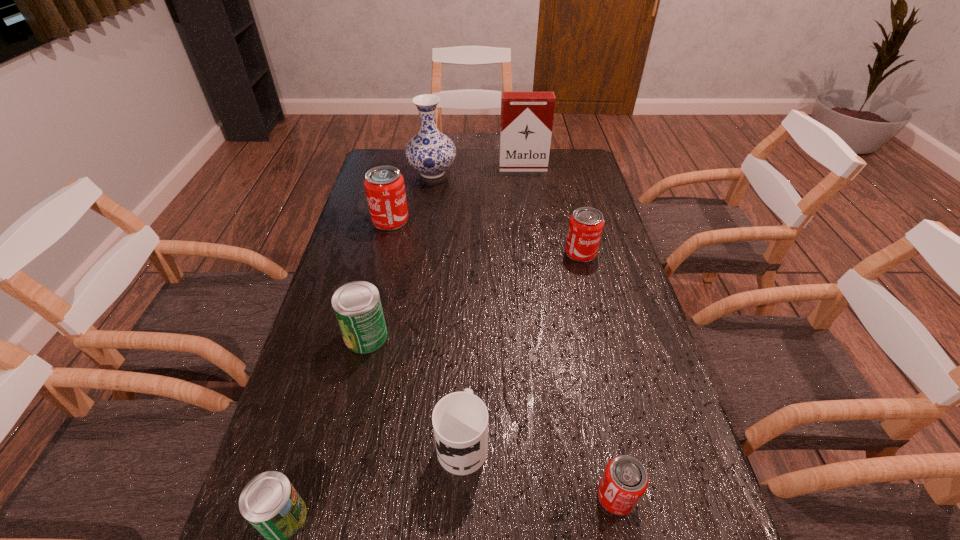
Image resolution: width=960 pixels, height=540 pixels. Identify the location of blue vase. (x=430, y=152).

At what (x,y) coordinates should I click in order to perform the action: click on cigarette_case. Please return your answer as a coordinate pair (x, y). Image resolution: width=960 pixels, height=540 pixels. Looking at the image, I should click on (526, 124).

Image resolution: width=960 pixels, height=540 pixels. Identify the location of the third tallest object. (384, 185).

Where is `the leftmost red can`? Image resolution: width=960 pixels, height=540 pixels. the leftmost red can is located at coordinates (384, 185).

This screenshot has width=960, height=540. I want to click on the fourth farthest object, so click(x=586, y=224).

I want to click on the second biggest red can, so click(x=586, y=224).

Identify the location of the fifth farthest object. (357, 305).

The image size is (960, 540). In order to click on the bigger green can in this screenshot , I will do `click(357, 305)`.

This screenshot has height=540, width=960. Find the location of `the third nearest object`. the third nearest object is located at coordinates (460, 420).

Image resolution: width=960 pixels, height=540 pixels. I want to click on white mug, so click(460, 420).